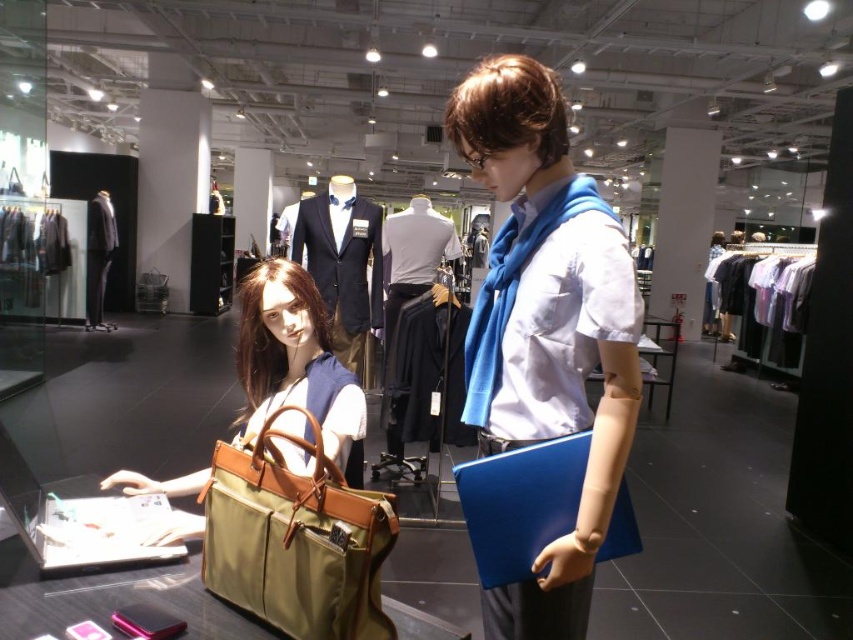
Question: Which of these objects is positioned closest to the white cotton shirt at center?

Choices:
 (A) tan leather briefcase at center
 (B) matte brown leather handbag at center
 (C) matte black suit at center

Answer: (C)

Question: Does matte brown leather handbag at center come in front of black suit at center?

Choices:
 (A) yes
 (B) no

Answer: (A)

Question: Which point is closer to the camera?

Choices:
 (A) tan leather briefcase at center
 (B) matte blue scarf at center
 (C) matte black suit at center
 (D) white cotton shirt at center

Answer: (A)

Question: Is matte black suit at center smaller than black suit at center?

Choices:
 (A) no
 (B) yes

Answer: (B)

Question: Considering the real-world distances, which object is closest to the matte black suit at center?

Choices:
 (A) black suit at center
 (B) tan leather briefcase at center
 (C) matte blue scarf at center

Answer: (C)

Question: Can you confirm if tan leather briefcase at center is smaller than white cotton shirt at center?

Choices:
 (A) no
 (B) yes

Answer: (B)